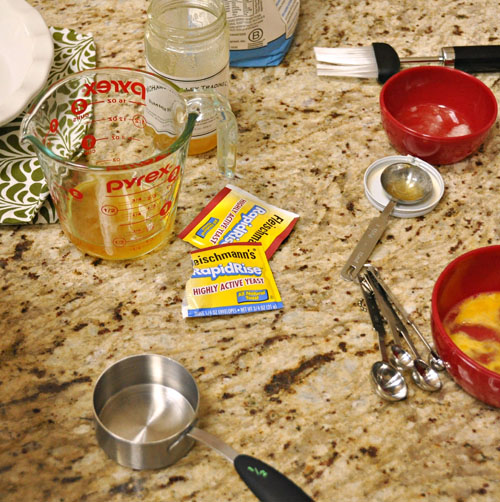
In order to click on measuring cup in this screenshot , I will do `click(153, 407)`, `click(134, 187)`.